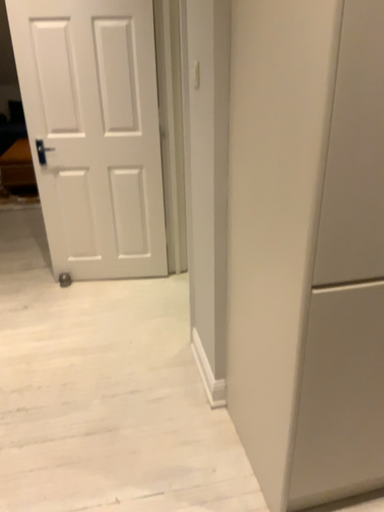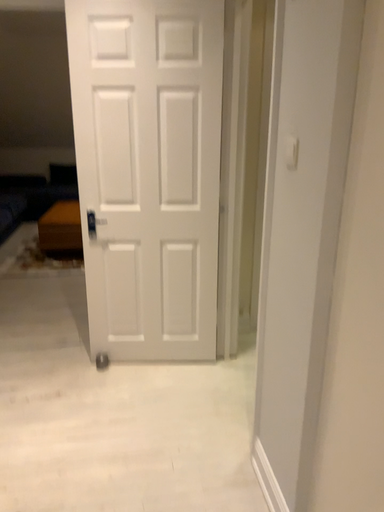
Question: How did the camera likely rotate when shooting the video?

Choices:
 (A) rotated upward
 (B) rotated downward

Answer: (A)